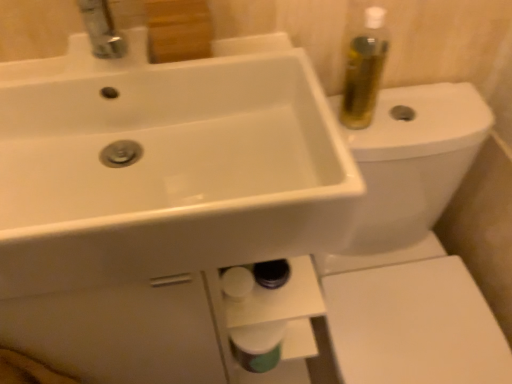
Question: From the image's perspective, is white glossy toilet at upper right above or below white glossy toilet paper at lower center?

Choices:
 (A) below
 (B) above

Answer: (B)

Question: Considering the positions of white glossy toilet at upper right and white glossy toilet paper at lower center in the image, is white glossy toilet at upper right wider or thinner than white glossy toilet paper at lower center?

Choices:
 (A) wide
 (B) thin

Answer: (A)

Question: Based on their relative distances, which object is nearer to the white glossy toilet paper at lower center?

Choices:
 (A) white glossy toilet at upper right
 (B) white glossy sink at upper left

Answer: (A)

Question: Estimate the real-world distances between objects in this image. Which object is farther from the white glossy toilet paper at lower center?

Choices:
 (A) white glossy sink at upper left
 (B) white glossy toilet at upper right

Answer: (A)